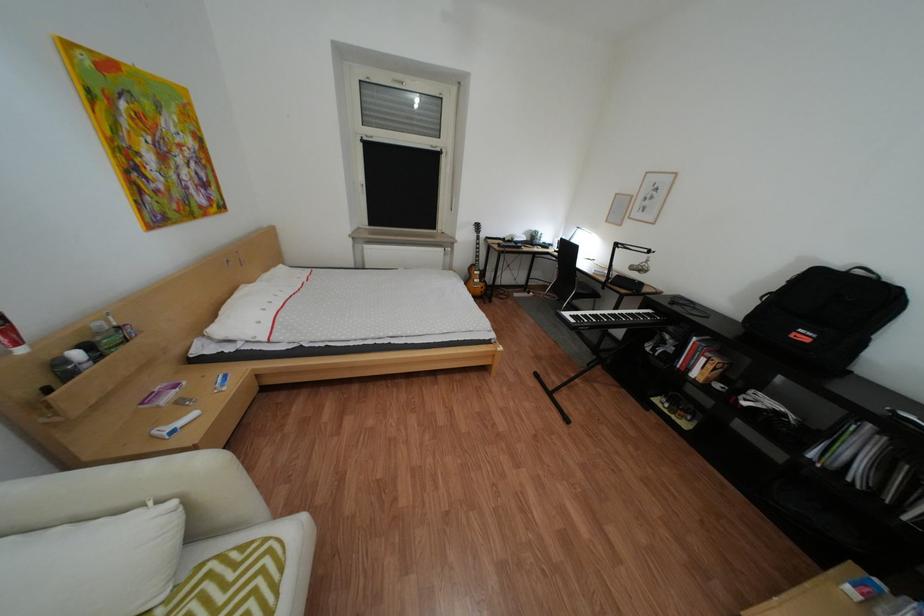
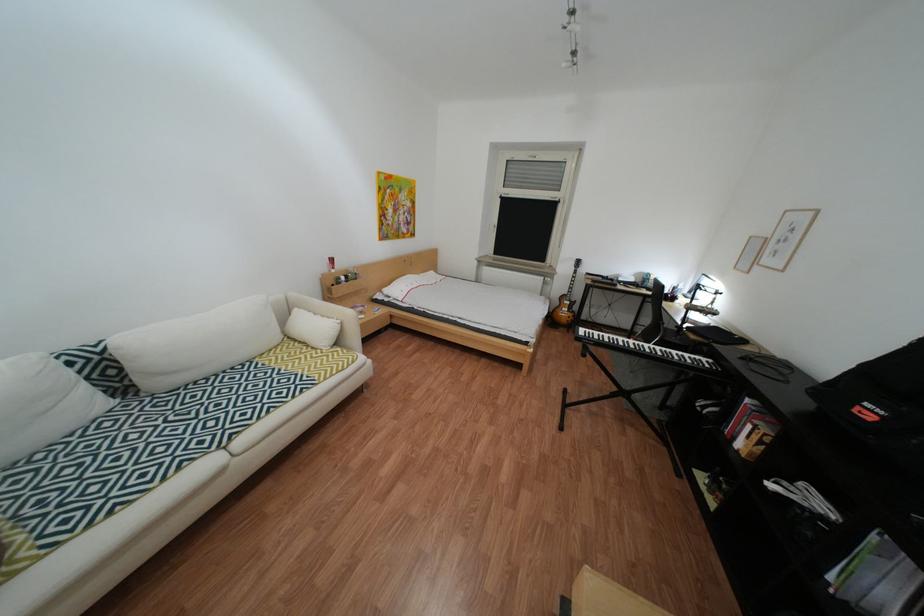
Locate, in the second image, the point that corresponds to point 704,371 in the first image.

(749, 439)